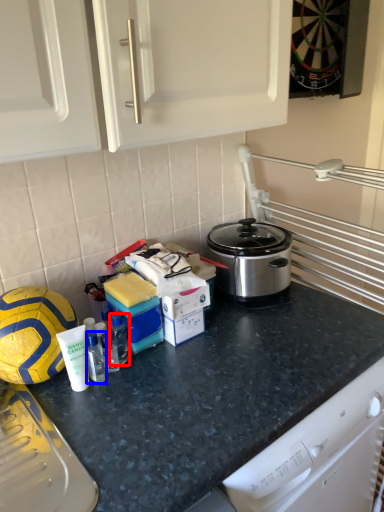
Question: Which object is closer to the camera taking this photo, bottle (highlighted by a red box) or bottle (highlighted by a blue box)?

Choices:
 (A) bottle
 (B) bottle

Answer: (B)